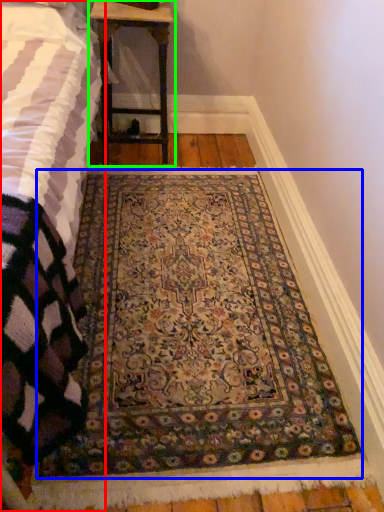
Question: Which is farther away from bed (highlighted by a red box)? mat (highlighted by a blue box) or table (highlighted by a green box)?

Choices:
 (A) mat
 (B) table

Answer: (B)